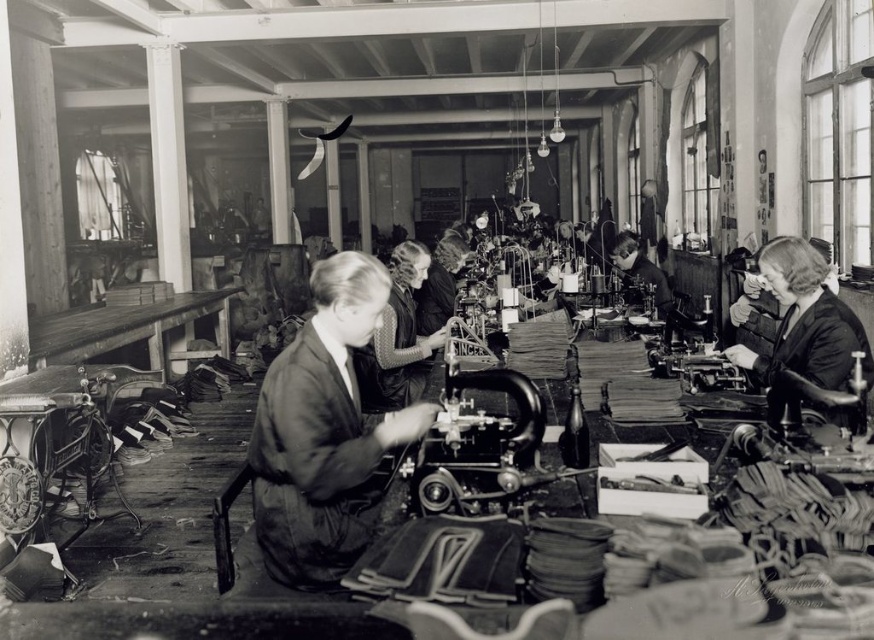
You are a tailor in the workshop and need to access both the dark fabric jacket at center and the matte black dress at center. If you are standing at the right side of the room near the windows, which item would you need to move towards first to reach the one on the left?

The dark fabric jacket at center is to the left of the matte black dress at center. Since you are standing at the right side of the room near the windows, the dark fabric jacket at center would be closer to you and thus the first item you would reach when moving towards the left.

You are standing in the middle of the sewing workshop and want to move towards the two points marked in the image. Which point, point (817,323) or point (390,352), is closer to you?

Point (817,323) is closer to the viewer than point (390,352), so you should head towards point (817,323) first.

You need to determine which item takes up more horizontal space between the dark fabric jacket at center and the matte black dress at center. Which one is wider?

The dark fabric jacket at center is wider than the matte black dress at center according to the description.